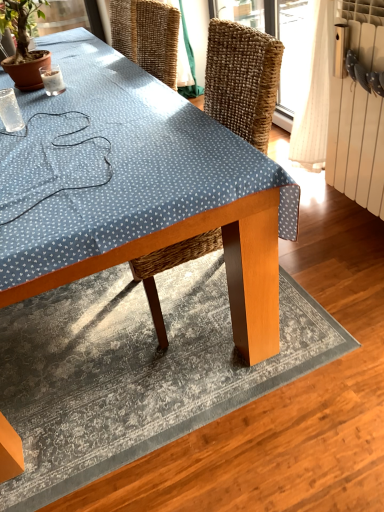
This screenshot has width=384, height=512. Find the location of `vacant space to the right of green leafy plant at upper left`. vacant space to the right of green leafy plant at upper left is located at coordinates (102, 78).